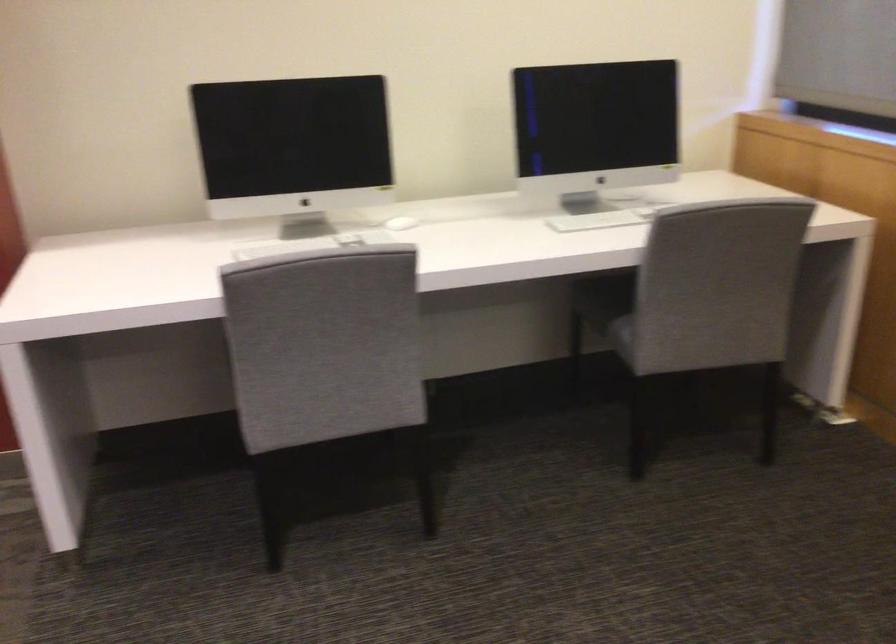
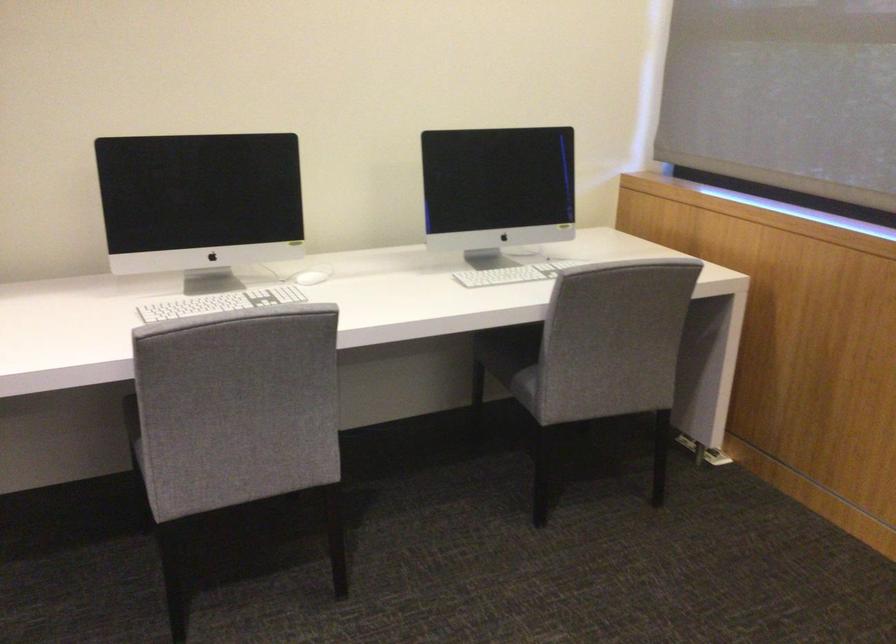
The point at [402,220] is marked in the first image. Where is the corresponding point in the second image?

(307, 277)